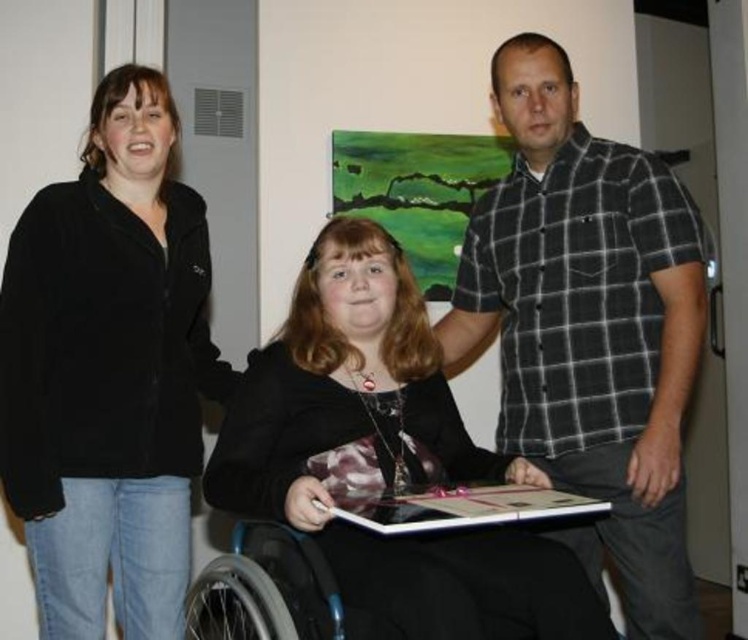
Question: Where is plaid shirt at center located in relation to black matte wheelchair at center in the image?

Choices:
 (A) below
 (B) above

Answer: (B)

Question: Based on their relative distances, which object is farther from the black fleece jacket at left?

Choices:
 (A) black matte wheelchair at center
 (B) plaid shirt at center

Answer: (B)

Question: Observing the image, what is the correct spatial positioning of black fleece jacket at left in reference to plaid shirt at center?

Choices:
 (A) below
 (B) above

Answer: (A)

Question: Can you confirm if black fleece jacket at left is wider than plaid shirt at center?

Choices:
 (A) yes
 (B) no

Answer: (B)

Question: Based on their relative distances, which object is nearer to the black fleece jacket at left?

Choices:
 (A) black matte wheelchair at center
 (B) plaid shirt at center

Answer: (A)

Question: Which object is farther from the camera taking this photo?

Choices:
 (A) black fleece jacket at left
 (B) plaid shirt at center

Answer: (B)